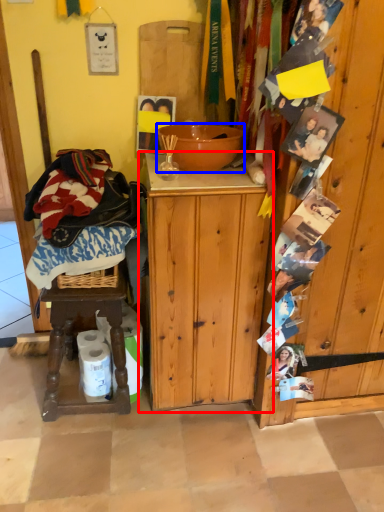
Question: Which object is further to the camera taking this photo, cabinetry (highlighted by a red box) or bowl (highlighted by a blue box)?

Choices:
 (A) cabinetry
 (B) bowl

Answer: (B)